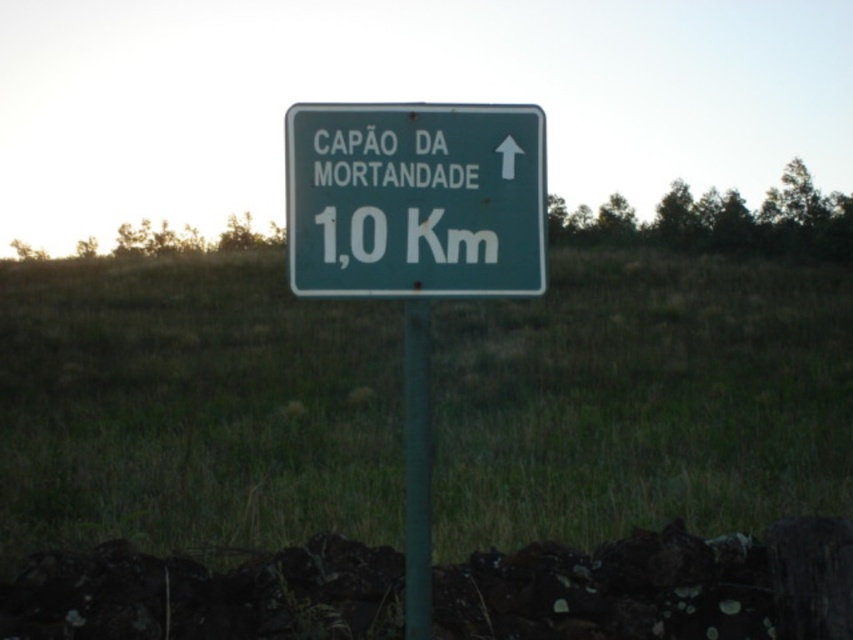
You are standing on the green grass at center and want to reach the green matte signpost at center. Which direction should you move to get there?

The green grass at center is positioned on the left side of the green matte signpost at center, so you should move to the right to reach the signpost.